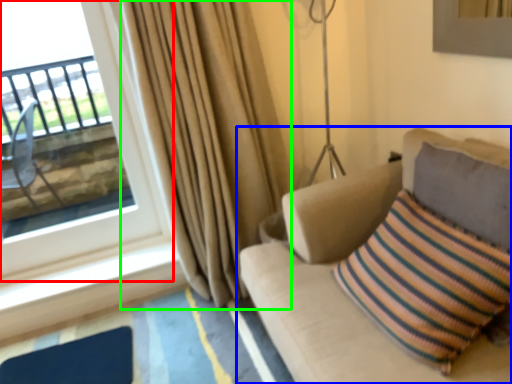
Question: Which object is positioned farthest from window (highlighted by a red box)? Select from studio couch (highlighted by a blue box) and curtain (highlighted by a green box).

Choices:
 (A) studio couch
 (B) curtain

Answer: (A)